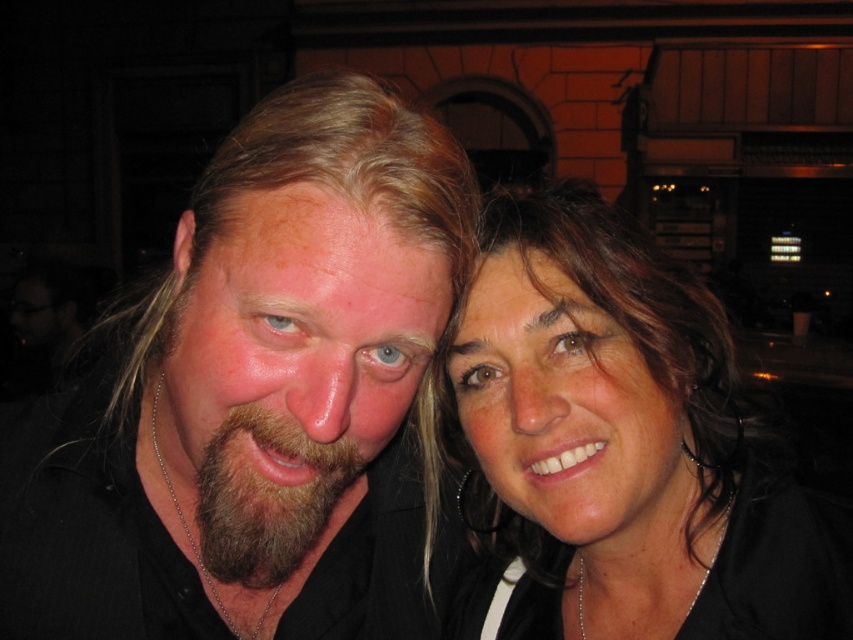
Question: Does matte black hair at upper right have a smaller size compared to brownwoollybeard at center?

Choices:
 (A) yes
 (B) no

Answer: (B)

Question: Which is nearer to the matte black hair at upper right?

Choices:
 (A) brownwoollybeard at center
 (B) matte black hair at center

Answer: (B)

Question: Is matte black hair at center to the right of brownwoollybeard at center from the viewer's perspective?

Choices:
 (A) yes
 (B) no

Answer: (B)

Question: Is matte black hair at center wider than brownwoollybeard at center?

Choices:
 (A) no
 (B) yes

Answer: (B)

Question: Among these objects, which one is nearest to the camera?

Choices:
 (A) matte black hair at upper right
 (B) matte black hair at center
 (C) brownwoollybeard at center

Answer: (B)

Question: Which of these objects is positioned closest to the matte black hair at upper right?

Choices:
 (A) matte black hair at center
 (B) brownwoollybeard at center

Answer: (A)